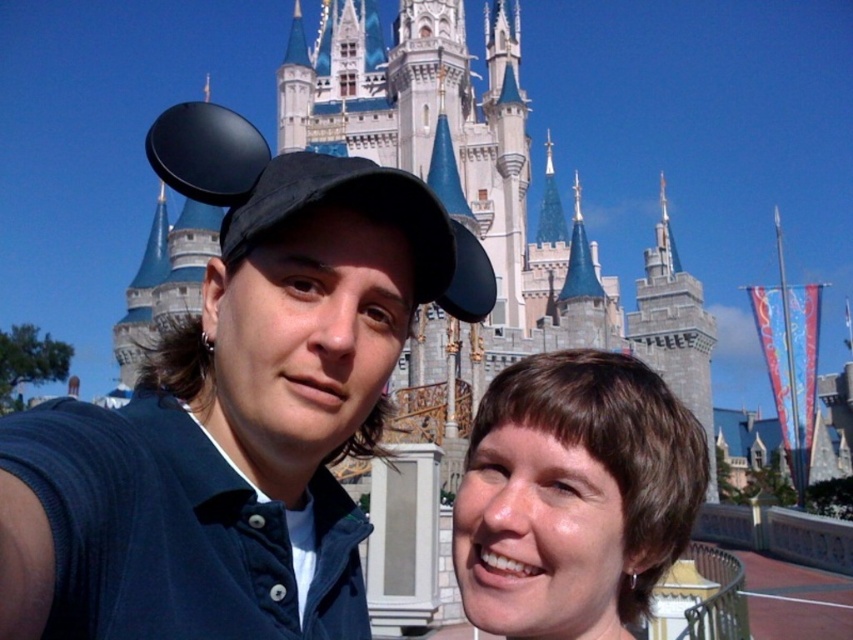
Question: Which of the following is the farthest from the observer?

Choices:
 (A) matte black cap at center
 (B) black fabric baseball cap at upper center
 (C) brown hair at center
 (D) white stone castle at center

Answer: (D)

Question: Which object is the closest to the black fabric baseball cap at upper center?

Choices:
 (A) matte black cap at center
 (B) brown hair at center
 (C) white stone castle at center

Answer: (A)

Question: Which of these objects is positioned closest to the brown hair at center?

Choices:
 (A) black fabric baseball cap at upper center
 (B) white stone castle at center

Answer: (A)

Question: Is the position of brown hair at center less distant than that of black fabric baseball cap at upper center?

Choices:
 (A) yes
 (B) no

Answer: (B)

Question: Does matte black cap at center have a larger size compared to black fabric baseball cap at upper center?

Choices:
 (A) yes
 (B) no

Answer: (B)

Question: Is white stone castle at center further to camera compared to black fabric baseball cap at upper center?

Choices:
 (A) no
 (B) yes

Answer: (B)